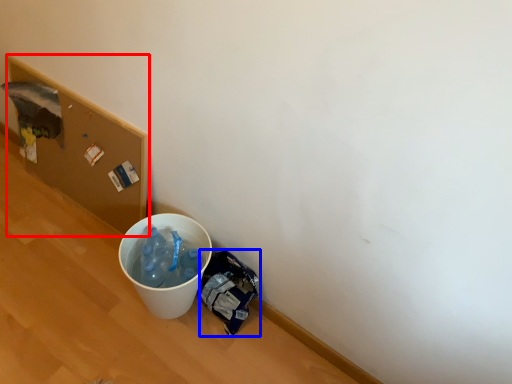
Question: Which object appears closest to the camera in this image, cardboard box (highlighted by a red box) or garbage (highlighted by a blue box)?

Choices:
 (A) cardboard box
 (B) garbage

Answer: (B)